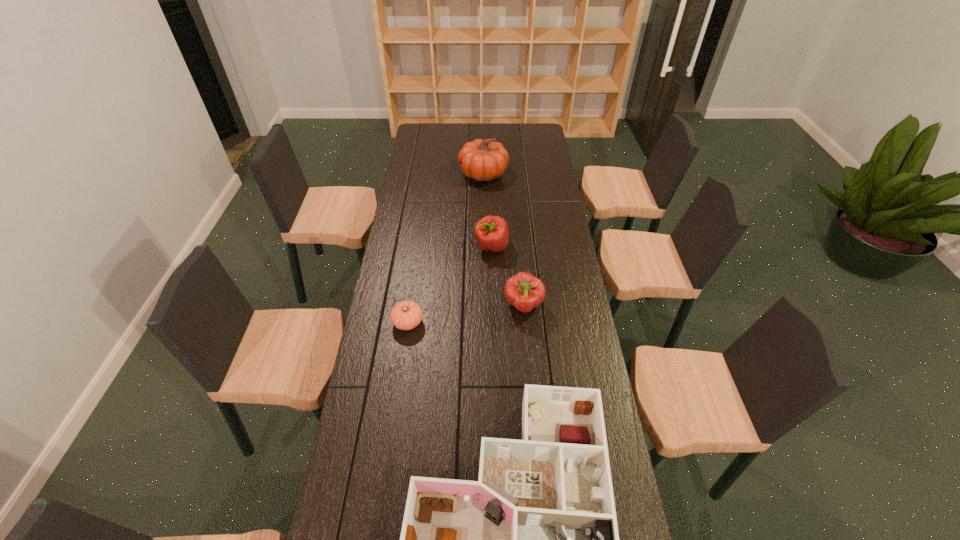
Find the location of a particular element. This screenshot has width=960, height=540. object that is the second nearest to the farther bell pepper is located at coordinates (406, 315).

Identify which object is the second closest to the tomato. Please provide its 2D coordinates. Your answer should be formatted as a tuple, i.e. [(x, y)], where the tuple contains the x and y coordinates of a point satisfying the conditions above.

[(523, 291)]

This screenshot has width=960, height=540. What are the coordinates of `free spot that satisfies the following two spatial constraints: 1. on the face of the tallest object; 2. on the front side of the leftmost object` in the screenshot? It's located at (485, 322).

Find the location of a particular element. vacant space that satisfies the following two spatial constraints: 1. on the face of the tallest object; 2. on the front side of the leftmost object is located at coordinates (485, 322).

Locate an element on the screen. This screenshot has width=960, height=540. free space that satisfies the following two spatial constraints: 1. on the face of the farther bell pepper; 2. on the left side of the tallest object is located at coordinates (484, 247).